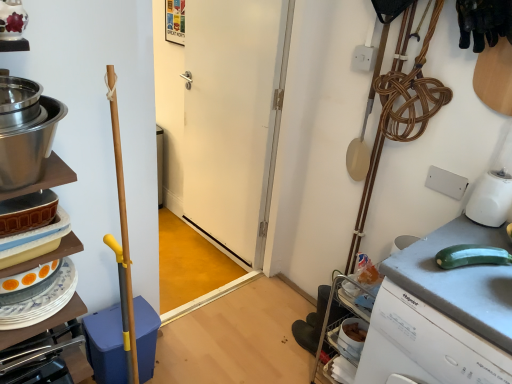
Question: From the image's perspective, is stainless steel bowl at left on white matte door at center?

Choices:
 (A) no
 (B) yes

Answer: (A)

Question: Is stainless steel bowl at left shorter than white matte door at center?

Choices:
 (A) yes
 (B) no

Answer: (A)

Question: Can we say stainless steel bowl at left lies outside white matte door at center?

Choices:
 (A) yes
 (B) no

Answer: (A)

Question: Is stainless steel bowl at left oriented away from white matte door at center?

Choices:
 (A) yes
 (B) no

Answer: (B)

Question: Considering the relative positions of stainless steel bowl at left and white matte door at center in the image provided, is stainless steel bowl at left to the right of white matte door at center from the viewer's perspective?

Choices:
 (A) no
 (B) yes

Answer: (A)

Question: Do you think matte ceramic dishes at left is within gray matte countertop at right, or outside of it?

Choices:
 (A) inside
 (B) outside

Answer: (B)

Question: Considering their positions, is matte ceramic dishes at left located in front of or behind gray matte countertop at right?

Choices:
 (A) behind
 (B) front

Answer: (B)

Question: Looking at their shapes, would you say matte ceramic dishes at left is wider or thinner than gray matte countertop at right?

Choices:
 (A) wide
 (B) thin

Answer: (B)

Question: From a real-world perspective, relative to gray matte countertop at right, is matte ceramic dishes at left vertically above or below?

Choices:
 (A) above
 (B) below

Answer: (A)

Question: In terms of width, does white matte door at center look wider or thinner when compared to gray matte countertop at right?

Choices:
 (A) wide
 (B) thin

Answer: (B)

Question: From a real-world perspective, relative to gray matte countertop at right, is white matte door at center vertically above or below?

Choices:
 (A) below
 (B) above

Answer: (B)

Question: In terms of height, does white matte door at center look taller or shorter compared to gray matte countertop at right?

Choices:
 (A) tall
 (B) short

Answer: (A)

Question: Is white matte door at center in front of or behind gray matte countertop at right in the image?

Choices:
 (A) behind
 (B) front

Answer: (A)

Question: Is gray matte countertop at right situated inside stainless steel bowl at left or outside?

Choices:
 (A) outside
 (B) inside

Answer: (A)

Question: Considering the positions of gray matte countertop at right and stainless steel bowl at left in the image, is gray matte countertop at right wider or thinner than stainless steel bowl at left?

Choices:
 (A) wide
 (B) thin

Answer: (A)